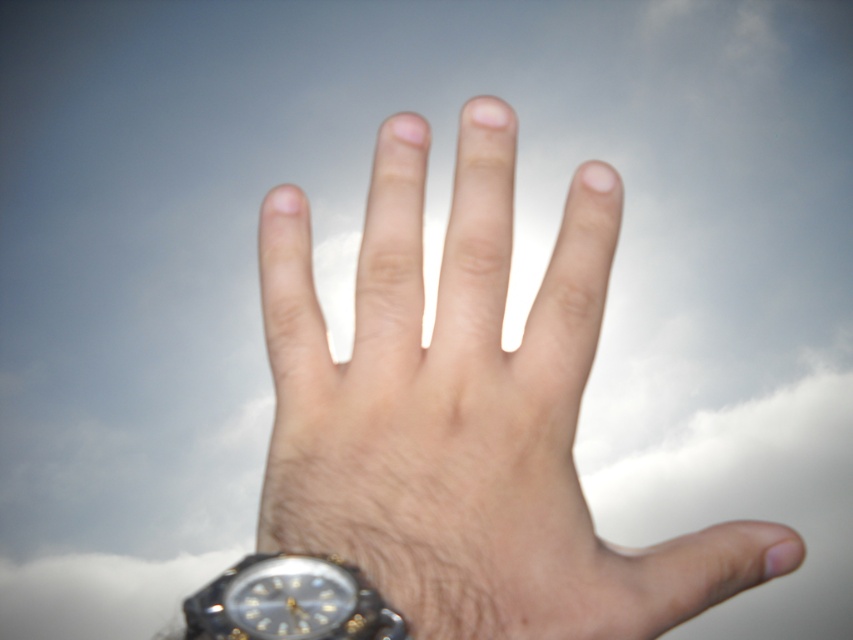
Does smooth skin hand at center appear on the left side of black plastic watch at lower left?

Incorrect, smooth skin hand at center is not on the left side of black plastic watch at lower left.

Does smooth skin hand at center have a smaller size compared to black plastic watch at lower left?

Actually, smooth skin hand at center might be larger than black plastic watch at lower left.

Does point (416, 193) come behind point (302, 624)?

Yes.

Locate an element on the screen. smooth skin hand at center is located at coordinates (467, 413).